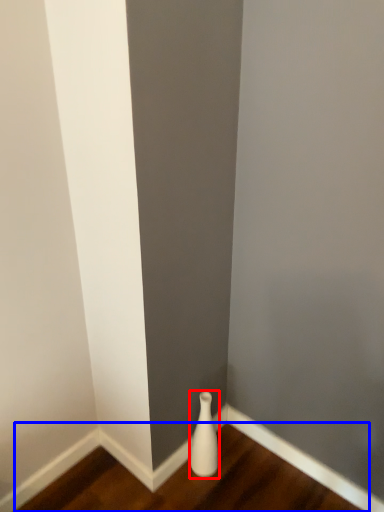
Question: Which object is closer to the camera taking this photo, vase (highlighted by a red box) or hardwood (highlighted by a blue box)?

Choices:
 (A) vase
 (B) hardwood

Answer: (B)